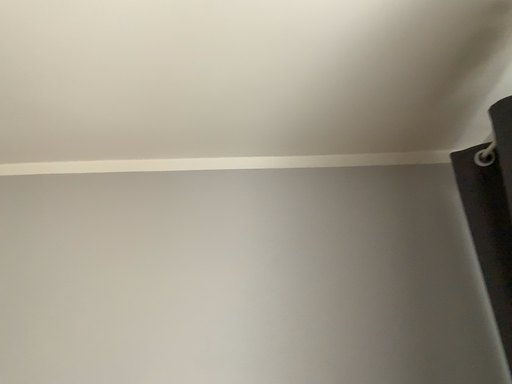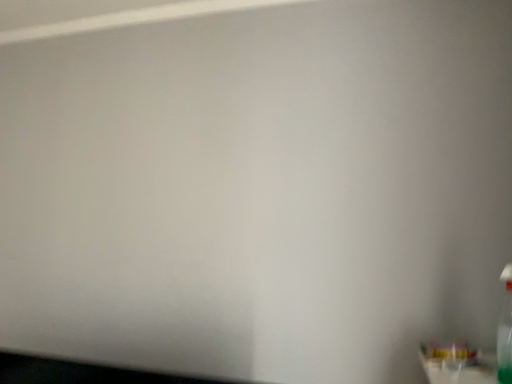
Question: Which way did the camera rotate in the video?

Choices:
 (A) rotated right
 (B) rotated left

Answer: (B)